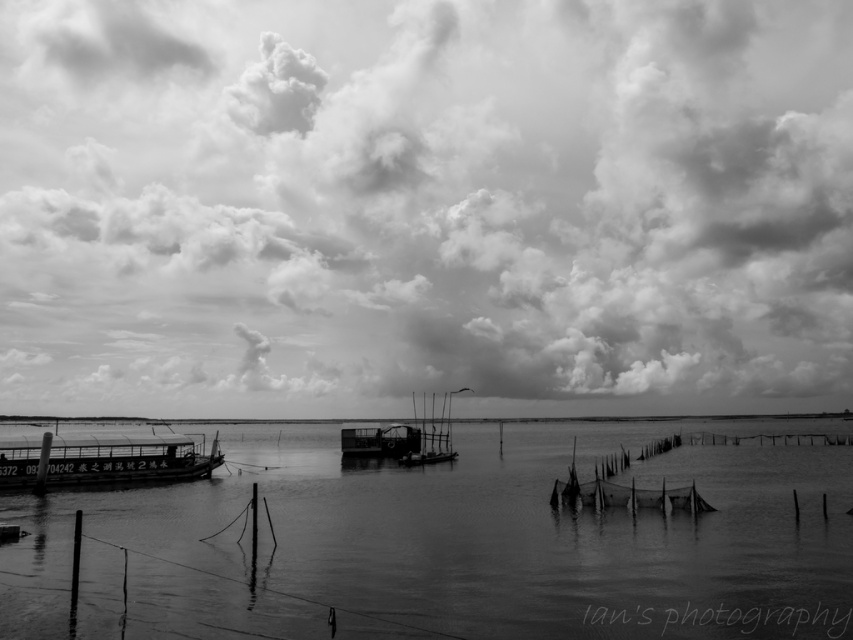
Can you confirm if smooth water at center is taller than metallic boat at center?

No.

Who is positioned more to the left, smooth water at center or metallic boat at center?

metallic boat at center is more to the left.

Find the location of a particular element. smooth water at center is located at coordinates (448, 547).

Image resolution: width=853 pixels, height=640 pixels. I want to click on smooth water at center, so click(448, 547).

Does cloudy sky at upper center have a lesser height compared to metallic boat at lower left?

In fact, cloudy sky at upper center may be taller than metallic boat at lower left.

Is point (144, 316) more distant than point (114, 456)?

Yes, point (144, 316) is behind point (114, 456).

You are a GUI agent. You are given a task and a screenshot of the screen. Output one action in this format:
    pyautogui.click(x=<x>, y=<y>)
    Task: Click on the cloudy sky at upper center
    This screenshot has height=640, width=853.
    Given the screenshot: What is the action you would take?
    pyautogui.click(x=424, y=205)

Is metallic boat at lower left shorter than metallic boat at center?

Correct, metallic boat at lower left is not as tall as metallic boat at center.

Looking at this image, is the position of metallic boat at lower left more distant than that of metallic boat at center?

No, it is in front of metallic boat at center.

Between point (15, 467) and point (450, 420), which one is positioned in front?

Point (15, 467) is in front.

Identify the location of metallic boat at lower left. (103, 460).